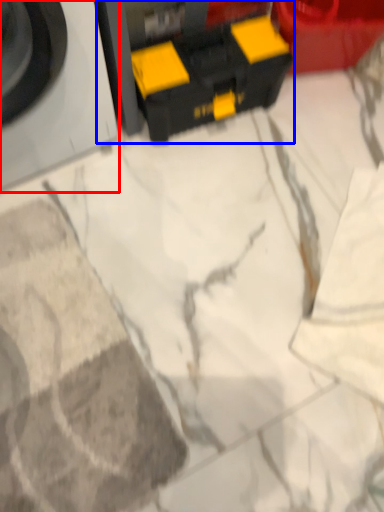
Question: Which point is closer to the camera, washing machine (highlighted by a red box) or toy (highlighted by a blue box)?

Choices:
 (A) washing machine
 (B) toy

Answer: (A)